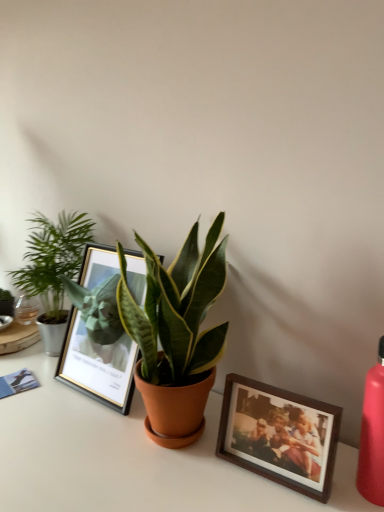
Where is `free spot in front of green glossy houseplant at center, positioned as the 1th houseplant in right-to-left order`? Image resolution: width=384 pixels, height=512 pixels. free spot in front of green glossy houseplant at center, positioned as the 1th houseplant in right-to-left order is located at coordinates (164, 488).